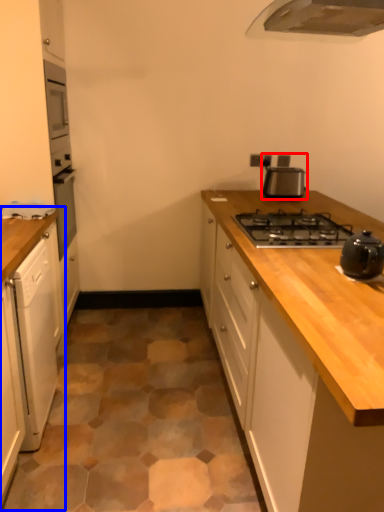
Question: Which of the following is the farthest to the observer, kitchen appliance (highlighted by a red box) or cabinetry (highlighted by a blue box)?

Choices:
 (A) kitchen appliance
 (B) cabinetry

Answer: (A)